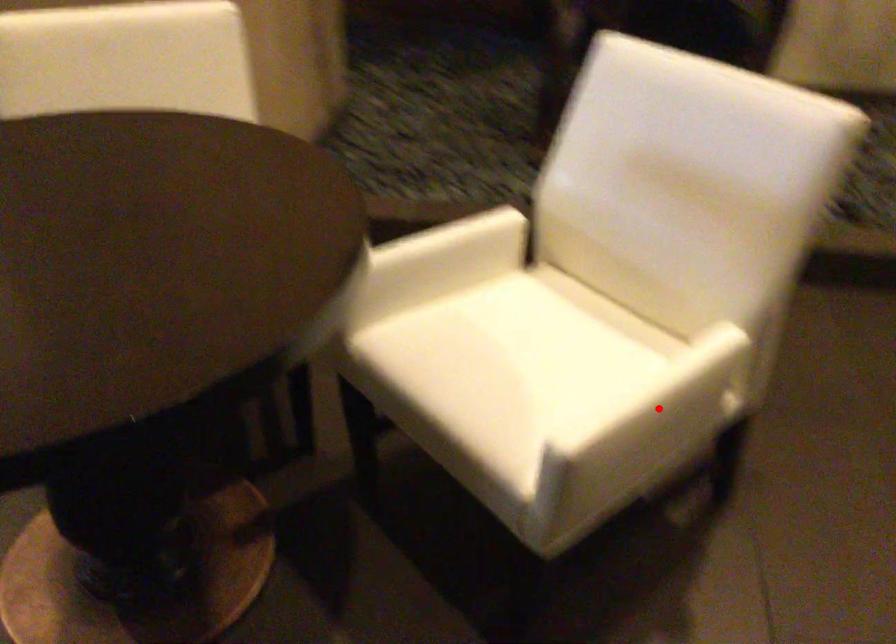
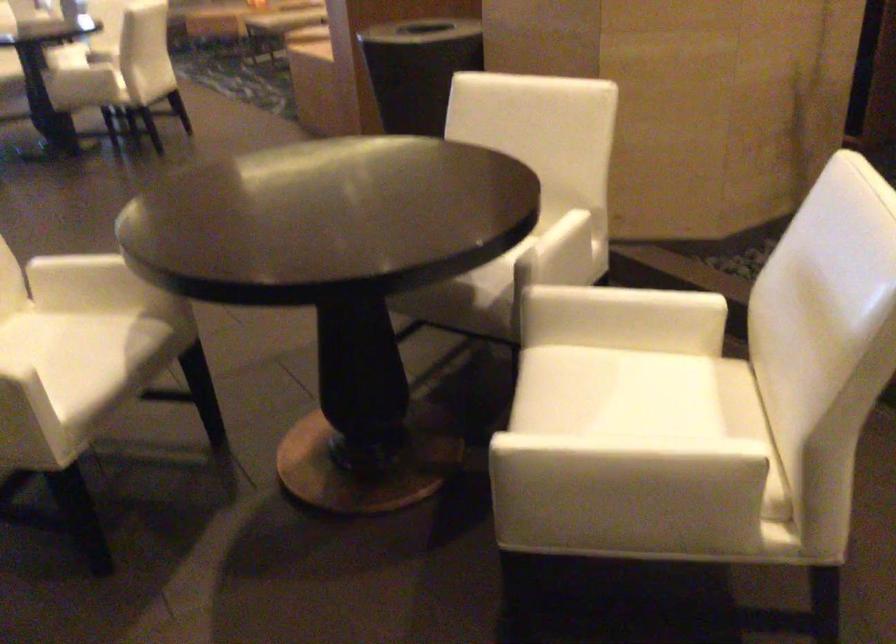
The point at the highlighted location is marked in the first image. Where is the corresponding point in the second image?

(607, 462)